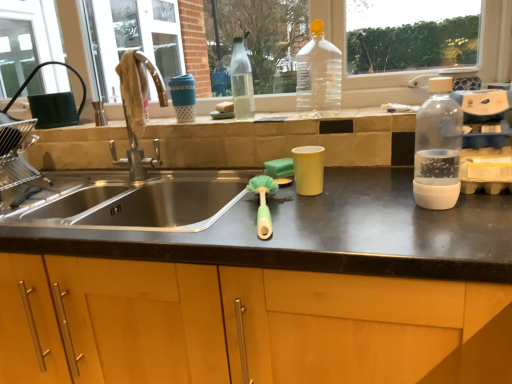
You are a GUI agent. You are given a task and a screenshot of the screen. Output one action in this format:
    pyautogui.click(x=<x>, y=<y>)
    Task: Click on the free space behind transparent plastic bottle at upper center, arranged as the second bottle when viewed from the left
    
    Given the screenshot: What is the action you would take?
    pyautogui.click(x=306, y=109)